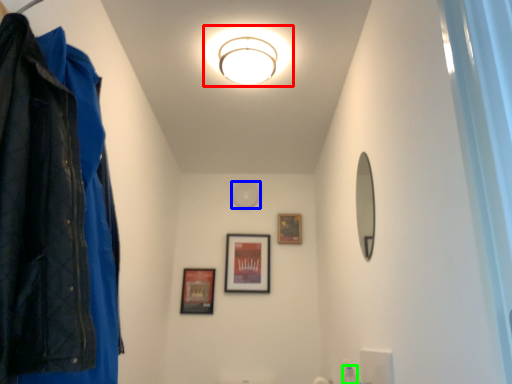
Question: Which object is the closest to the light fixture (highlighted by a red box)? Choose among these: light (highlighted by a blue box) or toiletry (highlighted by a green box).

Choices:
 (A) light
 (B) toiletry

Answer: (A)